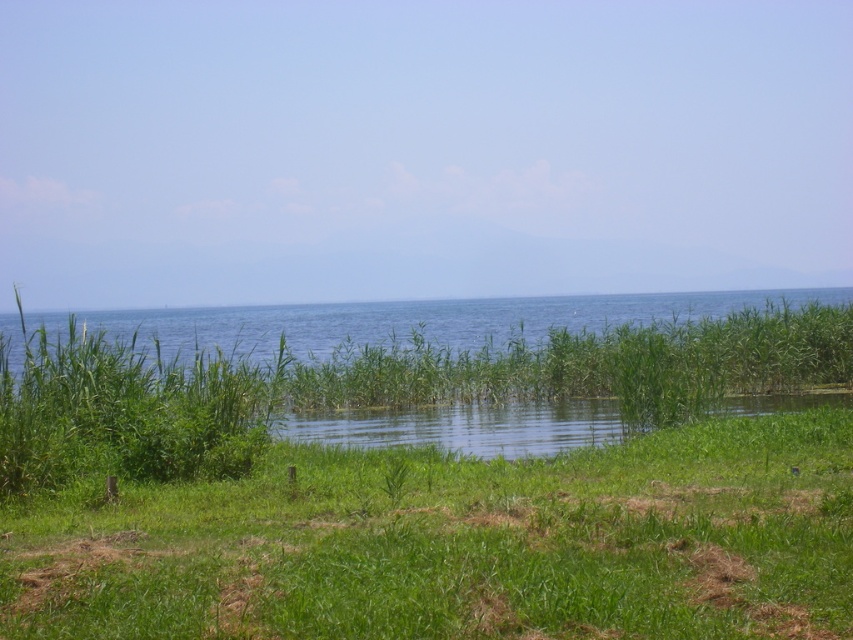
You are standing at the edge of the lakeside scene. You see the green grassy at lower center and the green grassy water at center. Which one is nearer to you?

The green grassy at lower center is closer to the viewer than the green grassy water at center.

You are planning to set up a small tent for a picnic. You have two options for the location based on the image description. The first option is on the green grassy at lower center, and the second option is on the green grassy water at center. Considering the thickness of the grass, which location would provide a more stable base for the tent?

The green grassy water at center is thicker than the green grassy at lower center, so setting up the tent on the green grassy water at center would provide a more stable base due to its thicker grass.